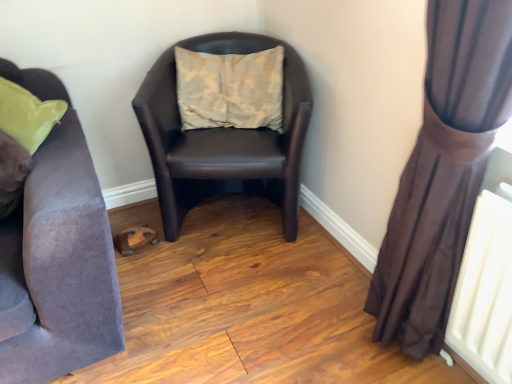
Find the location of a particular element. This screenshot has height=384, width=512. free spot in front of brown leather chair at center is located at coordinates pyautogui.click(x=231, y=291).